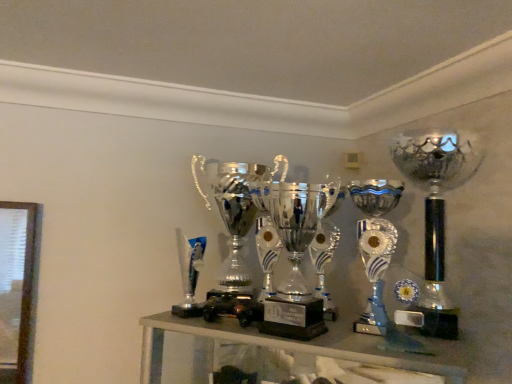
Question: From the image's perspective, is shiny silver trophy at center, positioned as the 2th trophy in right-to-left order, above or below polished silver trophy at center, positioned as the 1th trophy in left-to-right order?

Choices:
 (A) below
 (B) above

Answer: (A)

Question: Is shiny silver trophy at center, positioned as the 2th trophy in right-to-left order, wider or thinner than polished silver trophy at center, positioned as the 1th trophy in left-to-right order?

Choices:
 (A) wide
 (B) thin

Answer: (B)

Question: Which of these objects is positioned closest to the polished silver trophy at center, which is the 3th trophy in right-to-left order?

Choices:
 (A) silver/metallic trophy at right, arranged as the 3th trophy when viewed from the left
 (B) shiny silver trophy at center, which is the second trophy in left-to-right order

Answer: (B)

Question: Which object is the farthest from the silver/metallic trophy at right, acting as the 1th trophy starting from the right?

Choices:
 (A) polished silver trophy at center, positioned as the 1th trophy in left-to-right order
 (B) shiny silver trophy at center, positioned as the 2th trophy in right-to-left order

Answer: (A)